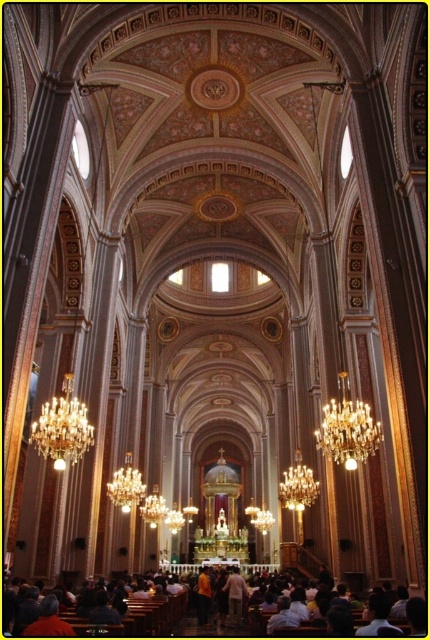
You are a visitor standing at the entrance of the cathedral. You notice the light brown wooden pew at lower center and the crystal gold chandelier at center. Which object would you estimate to be physically bigger in real life?

The light brown wooden pew at lower center is larger in size than the crystal gold chandelier at center, so the pew is physically bigger.

You are an interior designer assessing the cathedral. You need to determine which chandelier is more suitable for a smaller banquet setup. Which one between the gold crystal chandelier at left and the golden metallic chandelier at center would you recommend?

The gold crystal chandelier at left is smaller than the golden metallic chandelier at center, so it would be more suitable for a smaller banquet setup.